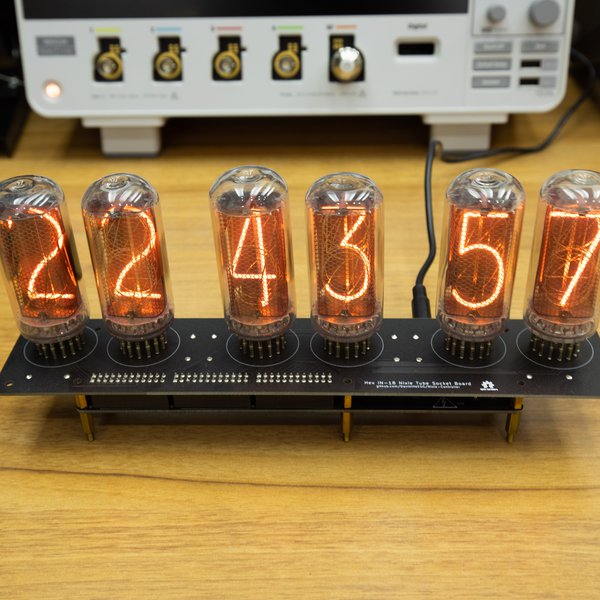
Identify the location of black stand. (382, 371), (220, 355).